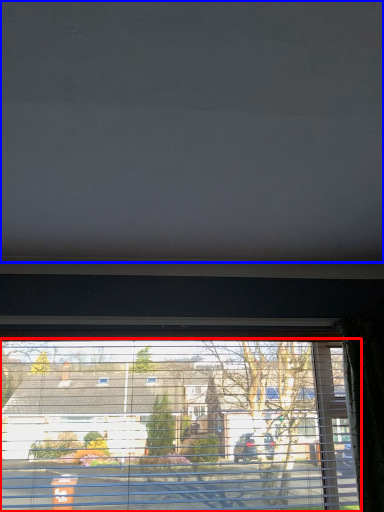
Question: Which object is closer to the camera taking this photo, window (highlighted by a red box) or blind (highlighted by a blue box)?

Choices:
 (A) window
 (B) blind

Answer: (B)